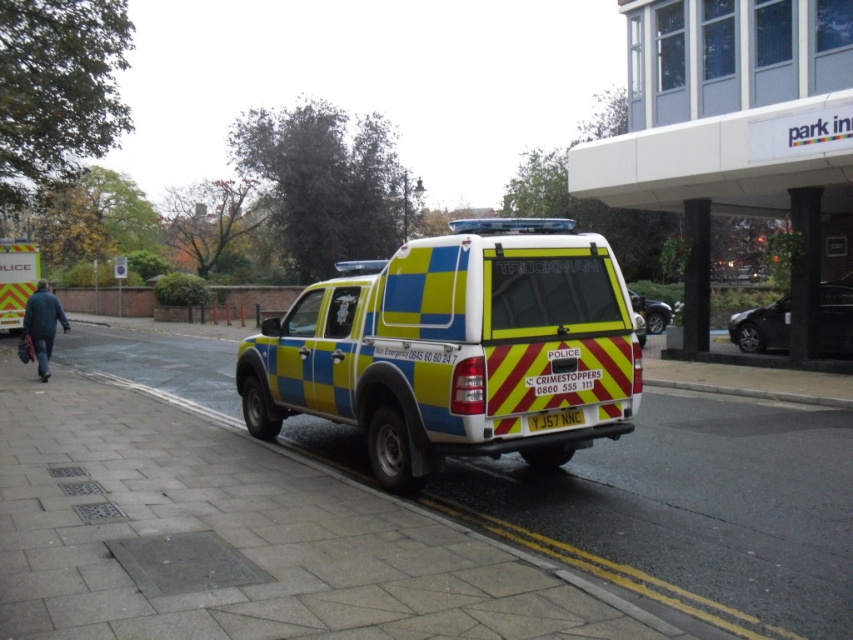
You are a delivery person standing on the yellow reflective plate at center. You need to place a heavy box onto the paved concrete sidewalk at center. Can you lift the box directly onto the sidewalk without moving your position?

The paved concrete sidewalk at center has a greater height compared to the yellow reflective plate at center, so you cannot lift the box directly onto the sidewalk without moving your position because the sidewalk is higher than your current position.

You are a delivery person standing on the sidewalk and need to place a package on the ground between the paved concrete sidewalk at center and the yellow reflective plate at center. Can you fit the package there?

The paved concrete sidewalk at center and yellow reflective plate at center are 9.06 feet apart from each other. Since the package requires only a small space, it can easily fit between them.